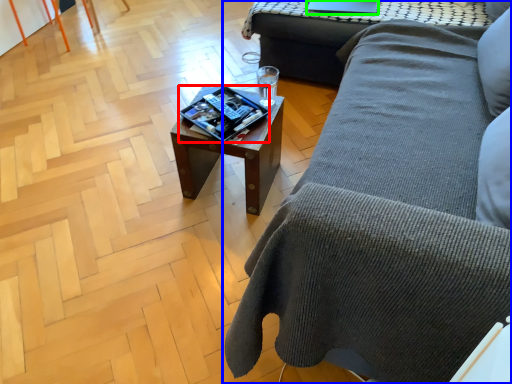
Question: Estimate the real-world distances between objects in this image. Which object is farther from magazine (highlighted by a red box), studio couch (highlighted by a blue box) or laptop (highlighted by a green box)?

Choices:
 (A) studio couch
 (B) laptop

Answer: (B)